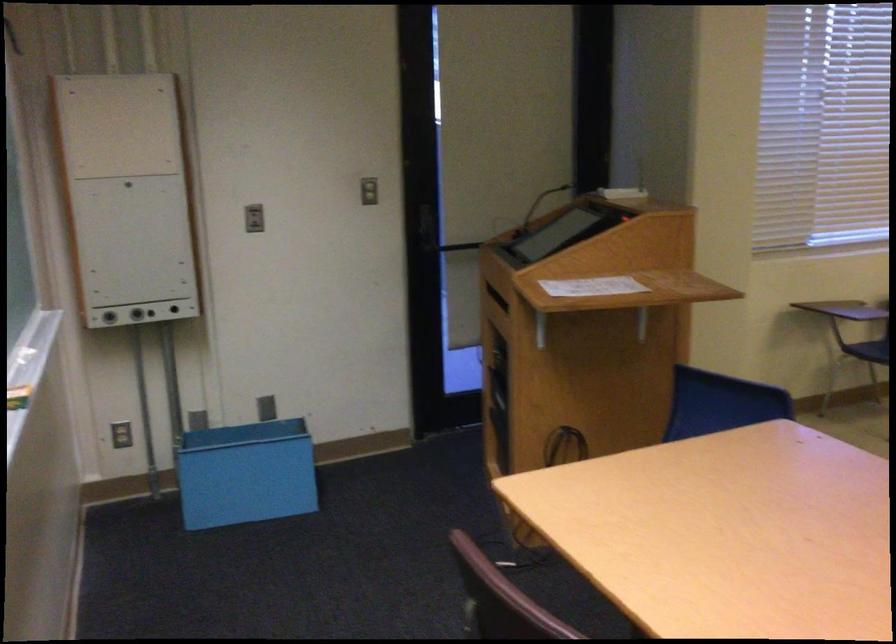
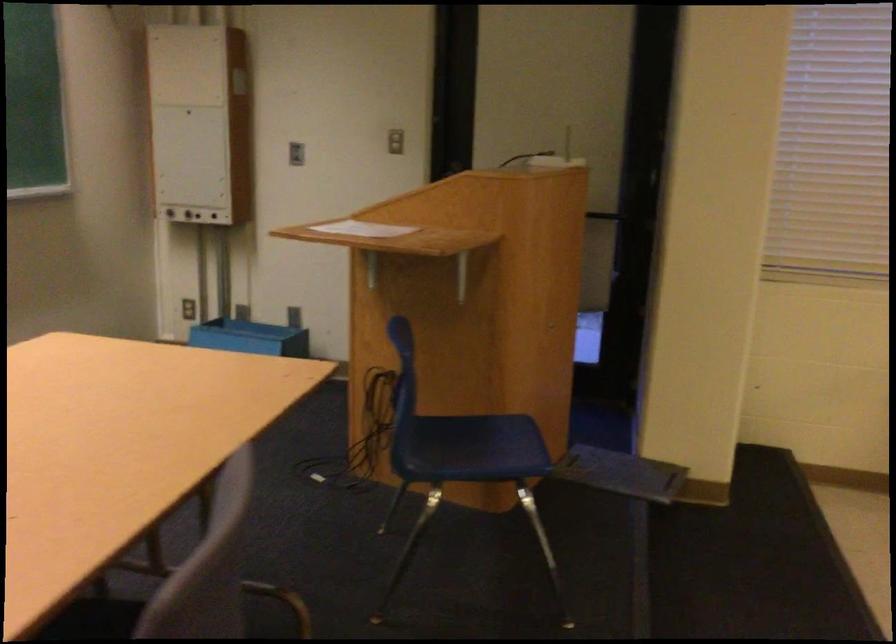
Locate, in the second image, the point that corresponds to (119,317) in the first image.

(167, 210)